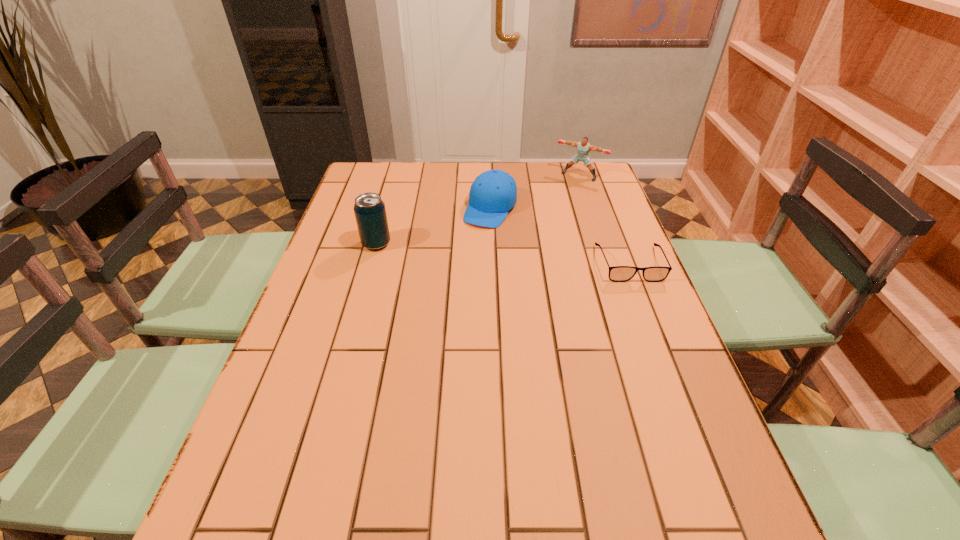
This screenshot has height=540, width=960. I want to click on free space on the desktop that is between the soda can and the shortest object and is positioned on the front-facing side of the farthest object, so click(520, 255).

Find the location of a particular element. vacant space on the desktop that is between the leftmost object and the spectacles and is positioned on the front-facing side of the second object from left to right is located at coordinates (465, 251).